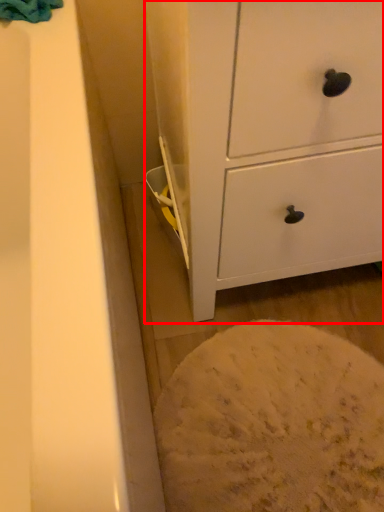
Question: Observing the image, what is the correct spatial positioning of chest of drawers (annotated by the red box) in reference to bath towel?

Choices:
 (A) left
 (B) right

Answer: (B)